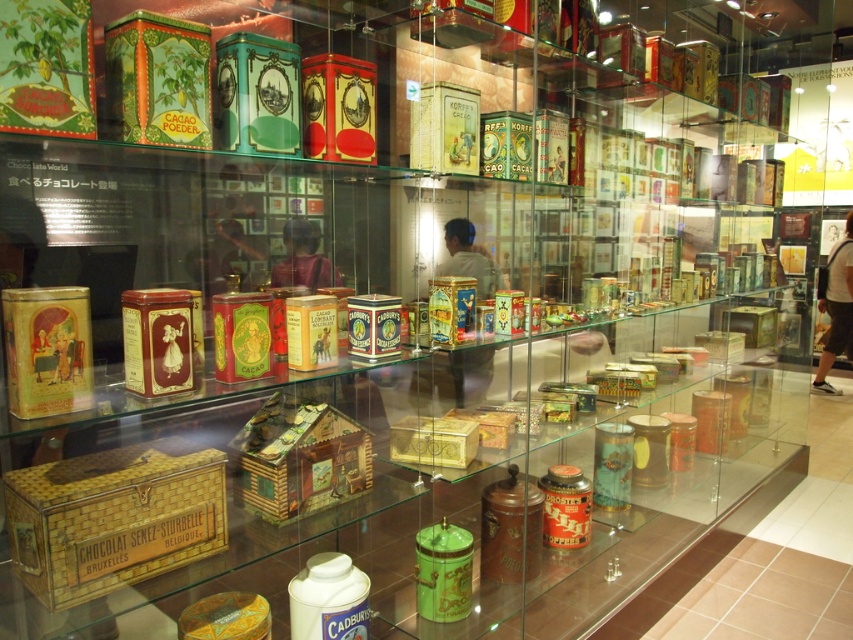
Question: Among these points, which one is farthest from the camera?

Choices:
 (A) (80, 548)
 (B) (410, 460)

Answer: (B)

Question: Among these points, which one is nearest to the camera?

Choices:
 (A) pyautogui.click(x=171, y=504)
 (B) pyautogui.click(x=294, y=516)
 (C) pyautogui.click(x=453, y=445)

Answer: (A)

Question: Among these points, which one is nearest to the camera?

Choices:
 (A) (85, 506)
 (B) (407, 440)
 (C) (276, 486)

Answer: (A)

Question: Does gold wicker box at lower left come behind gold metallic box at center?

Choices:
 (A) no
 (B) yes

Answer: (A)

Question: Is gold wicker box at lower left to the right of gold metallic box at center from the viewer's perspective?

Choices:
 (A) no
 (B) yes

Answer: (A)

Question: Observing the image, what is the correct spatial positioning of gold wicker box at lower left in reference to gold metallic box at center?

Choices:
 (A) above
 (B) below

Answer: (B)